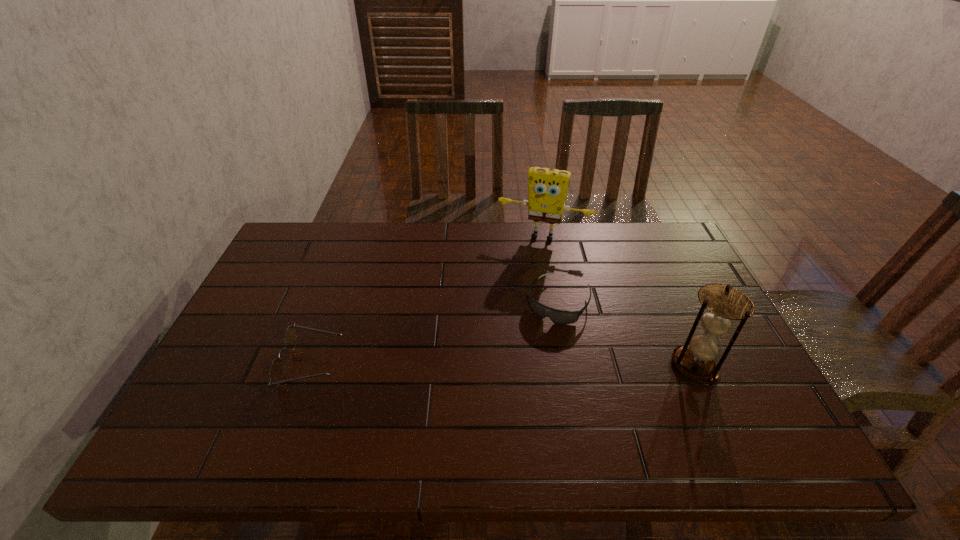
Where is `free spot on the desktop that is between the leftmost object and the hourglass and is positioned on the lenses of the shortest object`? free spot on the desktop that is between the leftmost object and the hourglass and is positioned on the lenses of the shortest object is located at coordinates (523, 364).

You are a GUI agent. You are given a task and a screenshot of the screen. Output one action in this format:
    pyautogui.click(x=<x>, y=<y>)
    Task: Click on the free spot on the desktop that is between the leftmost object and the hourglass and is positioned on the face of the sponge
    Image resolution: width=960 pixels, height=540 pixels.
    Given the screenshot: What is the action you would take?
    pyautogui.click(x=507, y=364)